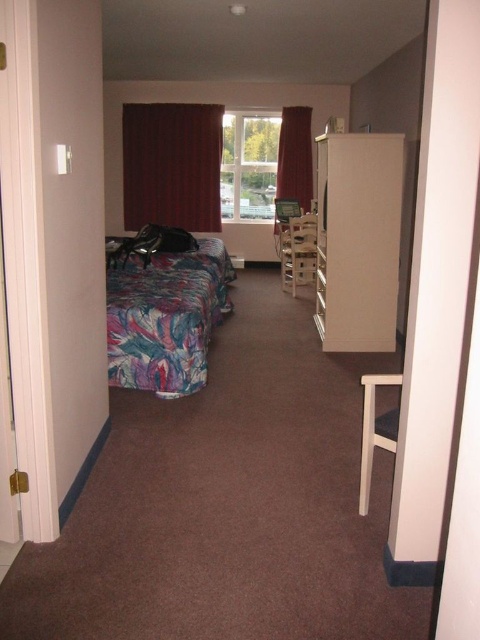
You are standing in the center of the room and see the point at coordinates (x=166, y=317). According to the image, where is this point located?

The point at coordinates (x=166, y=317) is located on the printed fabric bed at left.

You are trying to decide whether to hang a new curtain rod between the printed fabric bed at left and the velvet burgundy curtain at center. Based on their heights, which object would require a taller rod?

The velvet burgundy curtain at center is taller than the printed fabric bed at left, so the rod should be taller to accommodate the velvet burgundy curtain at center.